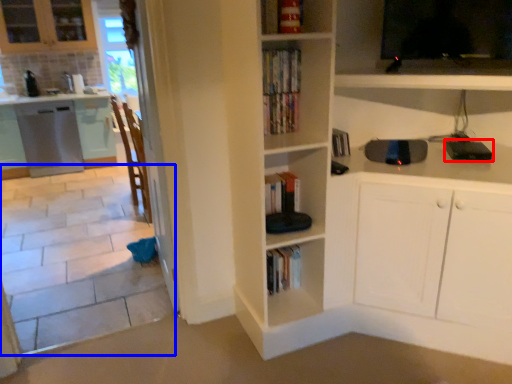
Question: Which of the following is the farthest to the observer, appliance (highlighted by a red box) or tile (highlighted by a blue box)?

Choices:
 (A) appliance
 (B) tile

Answer: (A)